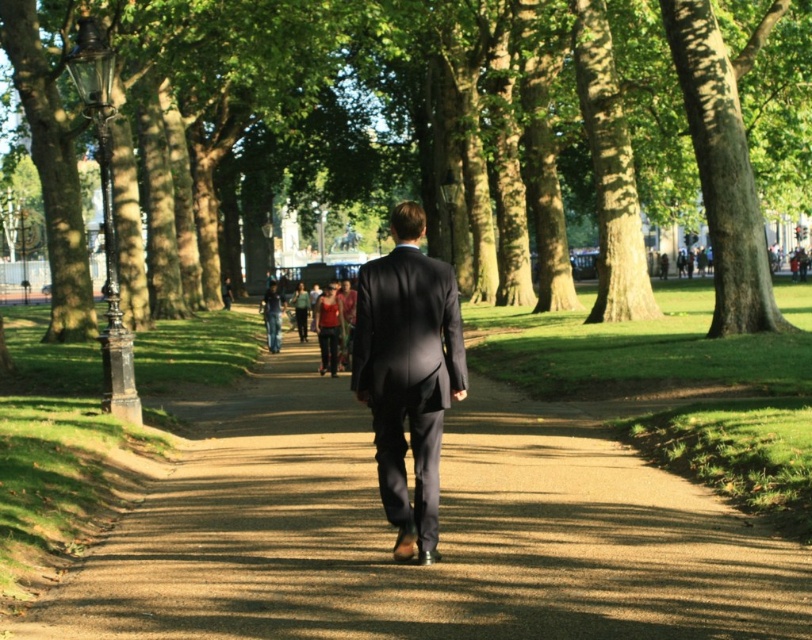
You are a photographer standing at the park entrance. You want to capture a photo where the green leafy tree at center and the dark gray suit at center are both visible. Which object will appear larger in the photo?

The green leafy tree at center will appear larger in the photo because it is taller than the dark gray suit at center.

In the scene shown: You are a park visitor wanting to walk from the entrance to the playground located at the far end of the green leafy tree at center. Given that the brown gravel path at center is the only path available, will you have enough space to walk comfortably if the path is narrower than the tree?

The green leafy tree at center is wider than the brown gravel path at center, so the path is narrower than the tree. Since the brown gravel path at center is the only path available, you will have enough space to walk comfortably as paths are typically designed to accommodate pedestrians even if narrower than surrounding features like trees.